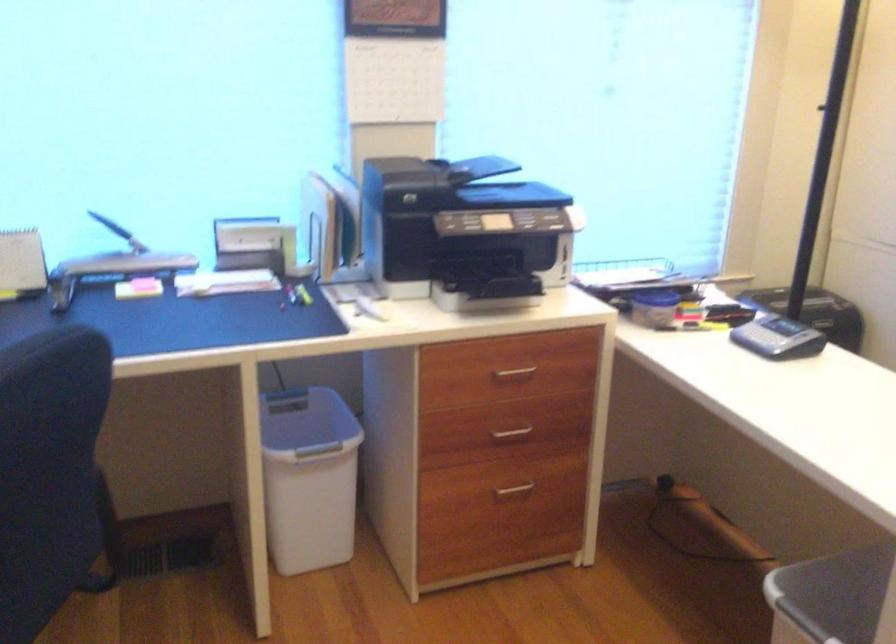
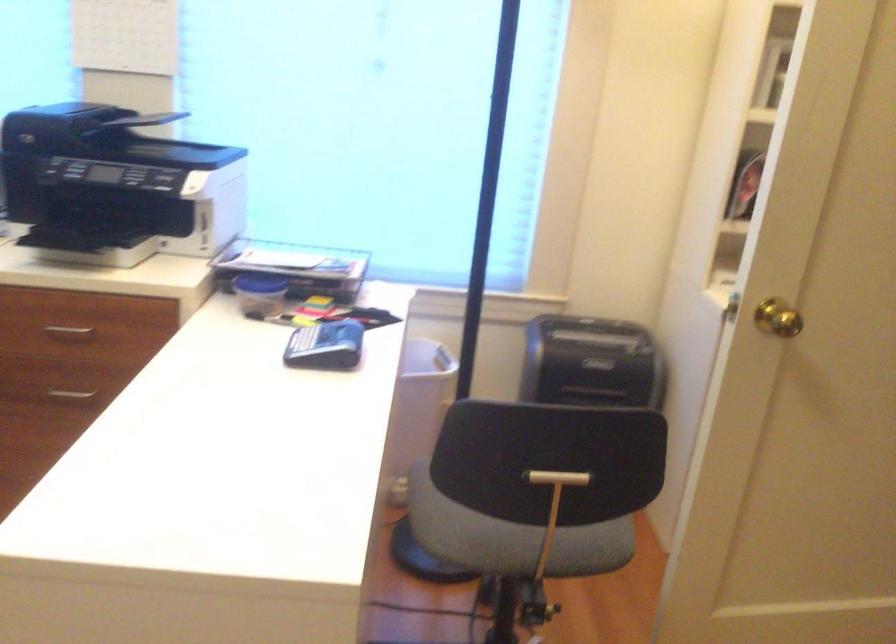
The point at (785, 336) is marked in the first image. Where is the corresponding point in the second image?

(325, 346)